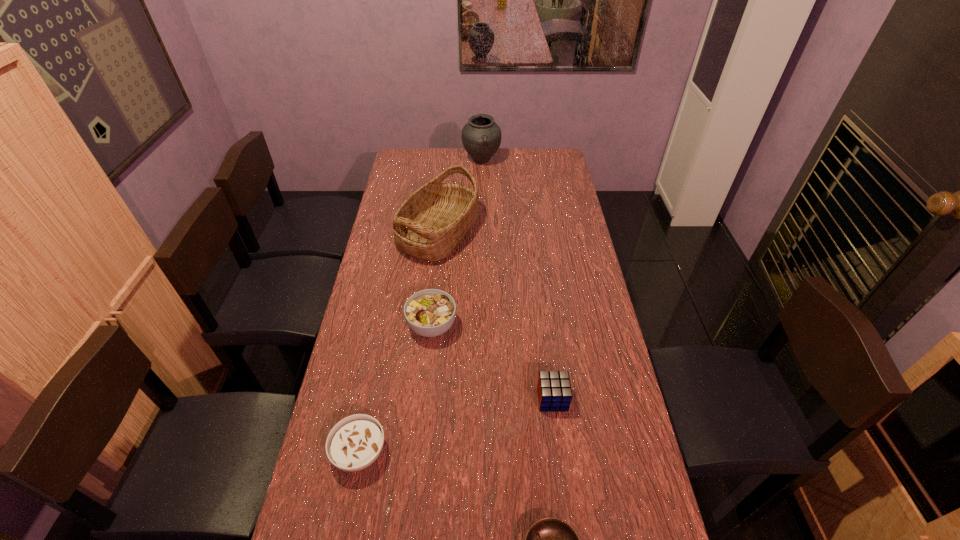
Find the location of a particular element. This screenshot has height=540, width=960. vacant space located 0.050m on the front of the cube is located at coordinates (556, 429).

Identify the location of vacant space situated 0.080m on the front of the fifth tallest object. This screenshot has width=960, height=540. (348, 515).

Locate an element on the screen. Image resolution: width=960 pixels, height=540 pixels. object positioned at the far edge is located at coordinates (481, 137).

Image resolution: width=960 pixels, height=540 pixels. I want to click on basket positioned at the left edge, so click(x=430, y=224).

The width and height of the screenshot is (960, 540). Identify the location of soup bowl present at the left edge. (354, 443).

At what (x,y) coordinates should I click in order to perform the action: click on vacant region at the far edge. Please return your answer as a coordinate pair (x, y). Looking at the image, I should click on (461, 153).

In the image, there is a desktop. Where is `vacant space at the left edge`? This screenshot has height=540, width=960. vacant space at the left edge is located at coordinates (394, 213).

This screenshot has width=960, height=540. Identify the location of vacant region at the right edge of the desktop. (607, 486).

In the image, there is a desktop. At what (x,y) coordinates should I click in order to perform the action: click on vacant space at the far right corner. Please return your answer as a coordinate pair (x, y). The height and width of the screenshot is (540, 960). Looking at the image, I should click on (548, 148).

The height and width of the screenshot is (540, 960). Find the location of `blank region between the second nearest object and the third nearest object`. blank region between the second nearest object and the third nearest object is located at coordinates (456, 426).